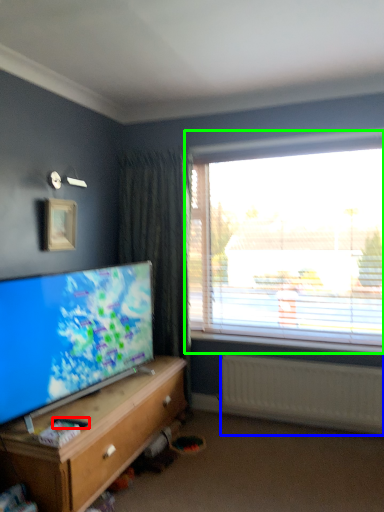
Question: Which object is positioned closest to remote control (highlighted by a red box)? Select from radiator (highlighted by a blue box) and window (highlighted by a green box).

Choices:
 (A) radiator
 (B) window

Answer: (A)